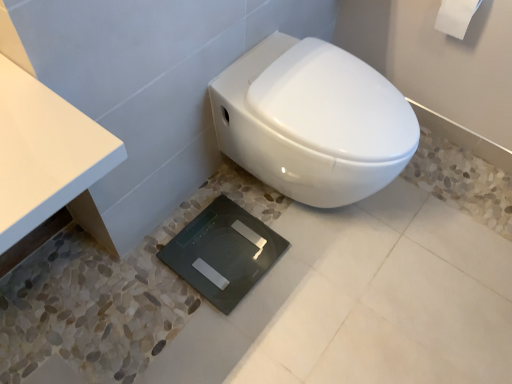
Describe the element at coordinates (456, 16) in the screenshot. I see `white matte toilet paper at upper right` at that location.

In order to click on white glossy toilet at center in this screenshot , I will do `click(313, 121)`.

Describe the element at coordinates (313, 121) in the screenshot. The height and width of the screenshot is (384, 512). I see `white glossy toilet at center` at that location.

Find the location of a particular element. Image resolution: width=512 pixels, height=384 pixels. black glass scale at center is located at coordinates (223, 253).

Who is smaller, white glossy toilet at center or white matte toilet paper at upper right?

With smaller size is white matte toilet paper at upper right.

Is white glossy toilet at center thinner than white matte toilet paper at upper right?

In fact, white glossy toilet at center might be wider than white matte toilet paper at upper right.

From the image's perspective, is white glossy toilet at center below white matte toilet paper at upper right?

Yes.

Between white glossy toilet at center and white matte toilet paper at upper right, which one appears on the left side from the viewer's perspective?

white glossy toilet at center.

Find the location of a particular element. This screenshot has width=512, height=384. pad located behind the white matte toilet paper at upper right is located at coordinates (223, 253).

Considering the relative sizes of black glass scale at center and white matte toilet paper at upper right in the image provided, is black glass scale at center wider than white matte toilet paper at upper right?

Yes, black glass scale at center is wider than white matte toilet paper at upper right.

Considering the sizes of black glass scale at center and white matte toilet paper at upper right in the image, is black glass scale at center taller or shorter than white matte toilet paper at upper right?

black glass scale at center is shorter than white matte toilet paper at upper right.

Is black glass scale at center surrounding white glossy toilet at center?

No, white glossy toilet at center is not surrounded by black glass scale at center.

From the image's perspective, which is above, black glass scale at center or white glossy toilet at center?

From the image's view, white glossy toilet at center is above.

Which object is positioned more to the left, black glass scale at center or white glossy toilet at center?

black glass scale at center.

Considering the sizes of objects black glass scale at center and white glossy toilet at center in the image provided, who is smaller, black glass scale at center or white glossy toilet at center?

black glass scale at center.

In the image, is white matte toilet paper at upper right positioned in front of or behind white glossy toilet at center?

In the image, white matte toilet paper at upper right appears behind white glossy toilet at center.

Consider the image. Which object is positioned more to the right, white matte toilet paper at upper right or white glossy toilet at center?

white matte toilet paper at upper right is more to the right.

Considering the sizes of white matte toilet paper at upper right and white glossy toilet at center in the image, is white matte toilet paper at upper right wider or thinner than white glossy toilet at center?

white matte toilet paper at upper right is thinner than white glossy toilet at center.

In the scene shown: Between white matte toilet paper at upper right and white glossy toilet at center, which one has less height?

Standing shorter between the two is white matte toilet paper at upper right.

Which object is thinner, white matte toilet paper at upper right or black glass scale at center?

white matte toilet paper at upper right is thinner.

Considering the positions of point (438, 19) and point (254, 222), is point (438, 19) closer or farther from the camera than point (254, 222)?

Point (438, 19).

From the image's perspective, does white matte toilet paper at upper right appear higher than black glass scale at center?

Indeed, from the image's perspective, white matte toilet paper at upper right is shown above black glass scale at center.

From a real-world perspective, which is physically below, white matte toilet paper at upper right or black glass scale at center?

black glass scale at center is physically lower.

Which object is wider, white glossy toilet at center or black glass scale at center?

white glossy toilet at center is wider.

Considering the sizes of objects white glossy toilet at center and black glass scale at center in the image provided, who is shorter, white glossy toilet at center or black glass scale at center?

black glass scale at center is shorter.

Which is closer, [317,53] or [231,268]?

Positioned in front is point [317,53].

Considering the relative positions of white glossy toilet at center and black glass scale at center in the image provided, is white glossy toilet at center to the right of black glass scale at center from the viewer's perspective?

Indeed, white glossy toilet at center is positioned on the right side of black glass scale at center.

Find the location of a particular element. toilet that appears below the white matte toilet paper at upper right (from a real-world perspective) is located at coordinates (313, 121).

Locate an element on the screen. pad behind the white matte toilet paper at upper right is located at coordinates pos(223,253).

From the image, which object appears to be nearer to white glossy toilet at center, white matte toilet paper at upper right or black glass scale at center?

black glass scale at center lies closer to white glossy toilet at center than the other object.

Looking at this image, which object lies nearer to the anchor point black glass scale at center, white matte toilet paper at upper right or white glossy toilet at center?

white glossy toilet at center is closer to black glass scale at center.

When comparing their distances from white glossy toilet at center, does black glass scale at center or white matte toilet paper at upper right seem further?

white matte toilet paper at upper right.

When comparing their distances from white matte toilet paper at upper right, does white glossy toilet at center or black glass scale at center seem further?

Among the two, black glass scale at center is located further to white matte toilet paper at upper right.

Estimate the real-world distances between objects in this image. Which object is further from white matte toilet paper at upper right, black glass scale at center or white glossy toilet at center?

black glass scale at center.

When comparing their distances from black glass scale at center, does white glossy toilet at center or white matte toilet paper at upper right seem further?

white matte toilet paper at upper right.

You are a GUI agent. You are given a task and a screenshot of the screen. Output one action in this format:
    pyautogui.click(x=<x>, y=<y>)
    Task: Click on the toilet between white matte toilet paper at upper right and black glass scale at center in the vertical direction
    
    Given the screenshot: What is the action you would take?
    point(313,121)